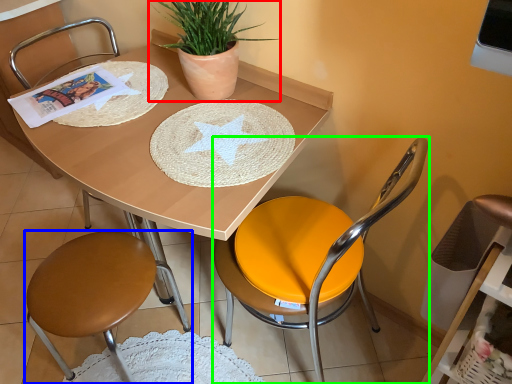
Question: Considering the real-world distances, which object is closest to houseplant (highlighted by a red box)? chair (highlighted by a blue box) or chair (highlighted by a green box).

Choices:
 (A) chair
 (B) chair

Answer: (B)